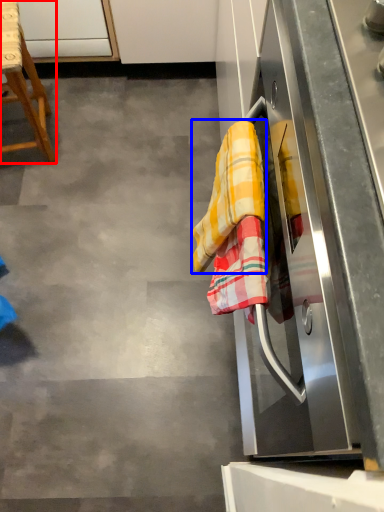
Question: Which point is further to the camera, furniture (highlighted by a red box) or material (highlighted by a blue box)?

Choices:
 (A) furniture
 (B) material

Answer: (A)